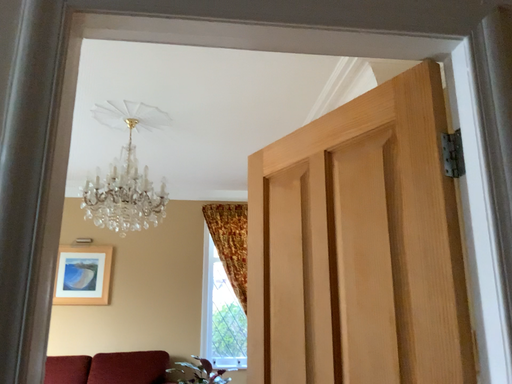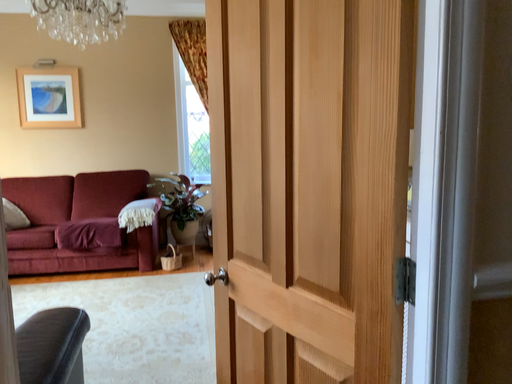
Question: How did the camera likely rotate when shooting the video?

Choices:
 (A) rotated downward
 (B) rotated upward

Answer: (A)